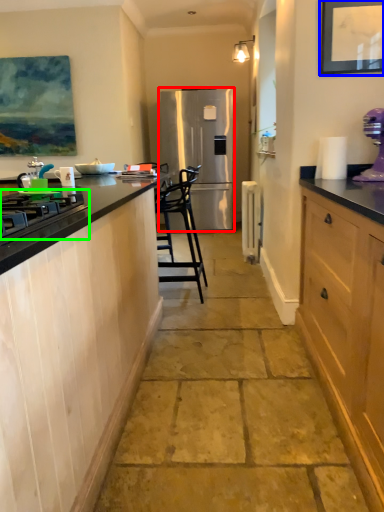
Question: Which object is positioned closest to refrigerator (highlighted by a red box)? Select from picture frame (highlighted by a blue box) and gas stove (highlighted by a green box).

Choices:
 (A) picture frame
 (B) gas stove

Answer: (A)